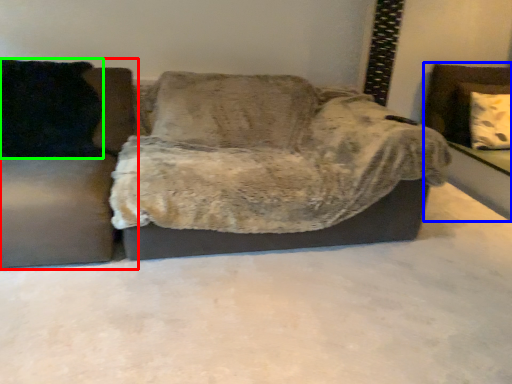
Question: Considering the real-world distances, which object is farthest from studio couch (highlighted by a red box)? swivel chair (highlighted by a blue box) or pillow (highlighted by a green box)?

Choices:
 (A) swivel chair
 (B) pillow

Answer: (A)